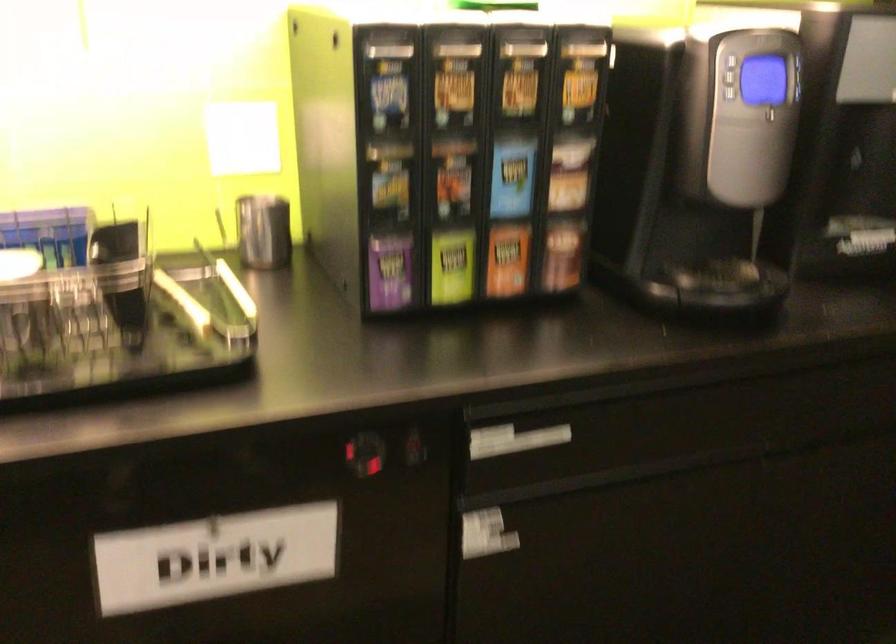
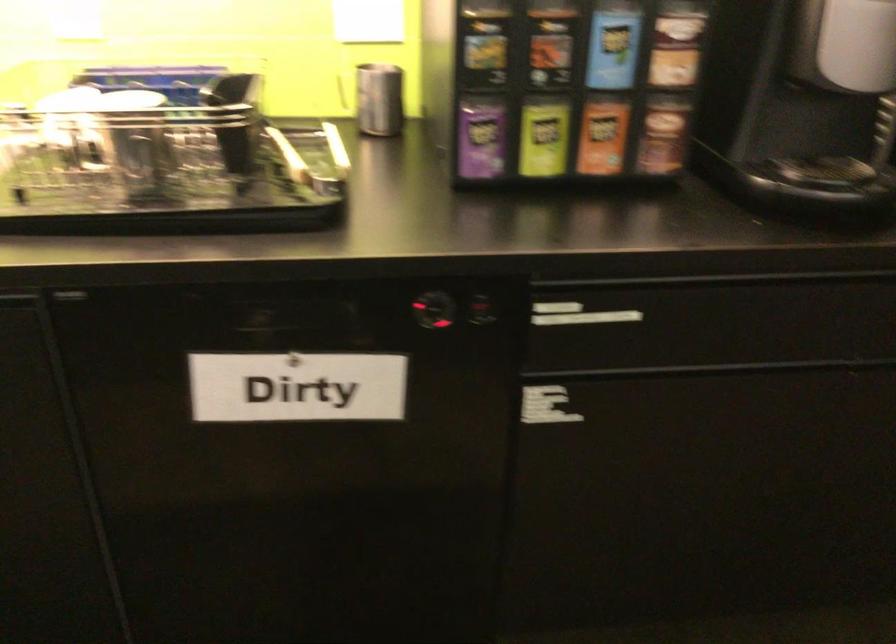
In the second image, find the point that corresponds to the point at 505,256 in the first image.

(602, 136)